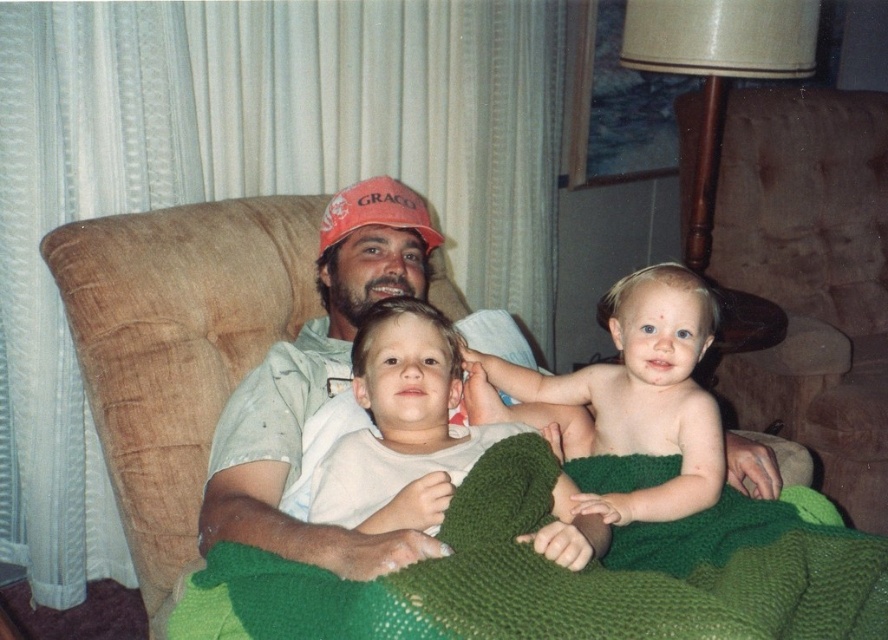
Does brown fabric couch at center appear over matte orange cap at center?

Yes.

Is point (204, 212) farther from camera compared to point (430, 547)?

Yes, it is behind point (430, 547).

I want to click on brown fabric couch at center, so click(x=176, y=344).

Who is taller, brown fabric couch at center or smooth skin baby at center?

With more height is brown fabric couch at center.

At what (x,y) coordinates should I click in order to perform the action: click on brown fabric couch at center. Please return your answer as a coordinate pair (x, y). Looking at the image, I should click on (176, 344).

I want to click on brown fabric couch at center, so (x=176, y=344).

Is point (90, 374) farther from viewer compared to point (329, 224)?

No, it is in front of (329, 224).

Who is higher up, brown fabric couch at center or orange fabric baseball cap at center?

orange fabric baseball cap at center is above.

Between point (171, 209) and point (405, 211), which one is positioned behind?

Positioned behind is point (171, 209).

Where is `brown fabric couch at center`? Image resolution: width=888 pixels, height=640 pixels. brown fabric couch at center is located at coordinates (176, 344).